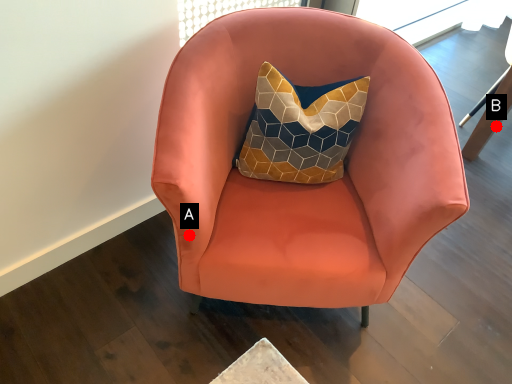
Question: Two points are circled on the image, labeled by A and B beside each circle. Which point is closer to the camera taking this photo?

Choices:
 (A) A is closer
 (B) B is closer

Answer: (A)